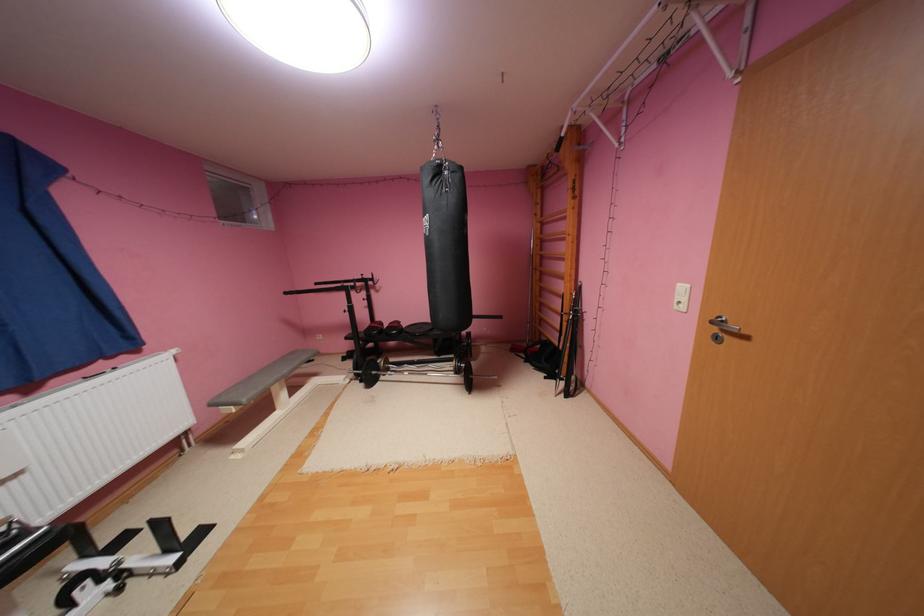
Where would you push the white light switch? Please return your answer as a coordinate pair (x, y).

(681, 297)